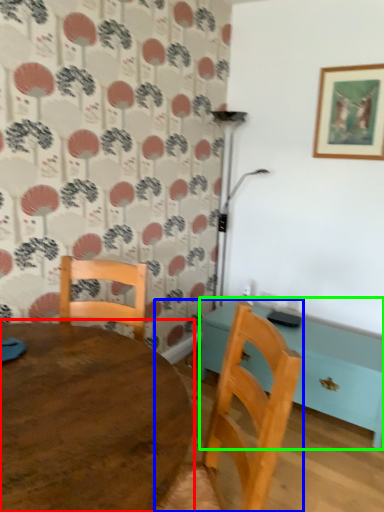
Question: Estimate the real-world distances between objects in this image. Which object is farther from table (highlighted by a red box), chair (highlighted by a blue box) or table (highlighted by a green box)?

Choices:
 (A) chair
 (B) table

Answer: (B)